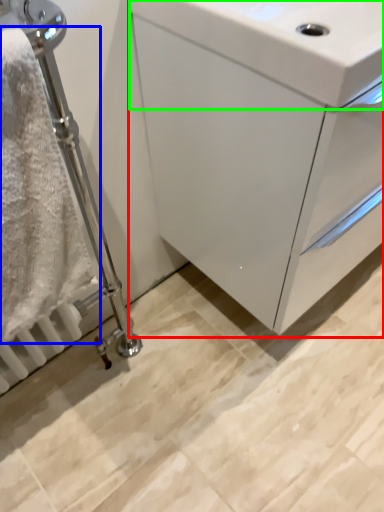
Question: Which object is the closest to the bathroom cabinet (highlighted by a red box)? Choose among these: bath towel (highlighted by a blue box) or sink (highlighted by a green box).

Choices:
 (A) bath towel
 (B) sink

Answer: (B)